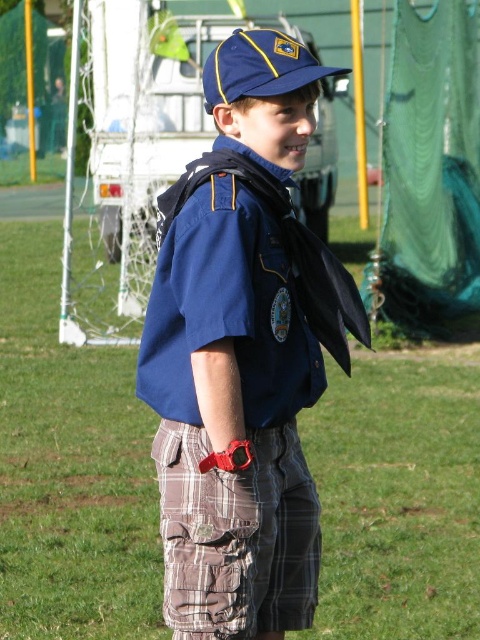
Question: Can you confirm if green grass at center is bigger than blue fabric baseball cap at upper center?

Choices:
 (A) yes
 (B) no

Answer: (A)

Question: Among these points, which one is farthest from the camera?

Choices:
 (A) (169, 515)
 (B) (274, 88)
 (C) (344, 289)

Answer: (C)

Question: Is green grass at center positioned behind blue cotton shirt at center?

Choices:
 (A) yes
 (B) no

Answer: (A)

Question: Which point is closer to the camera taking this photo?

Choices:
 (A) (55, 461)
 (B) (217, 61)

Answer: (B)

Question: Can you confirm if brown plaid shorts at center is wider than blue fabric baseball cap at upper center?

Choices:
 (A) no
 (B) yes

Answer: (B)

Question: Which point is farther from the camera taking this photo?

Choices:
 (A) (32, 483)
 (B) (292, 52)
 (C) (290, 404)

Answer: (A)